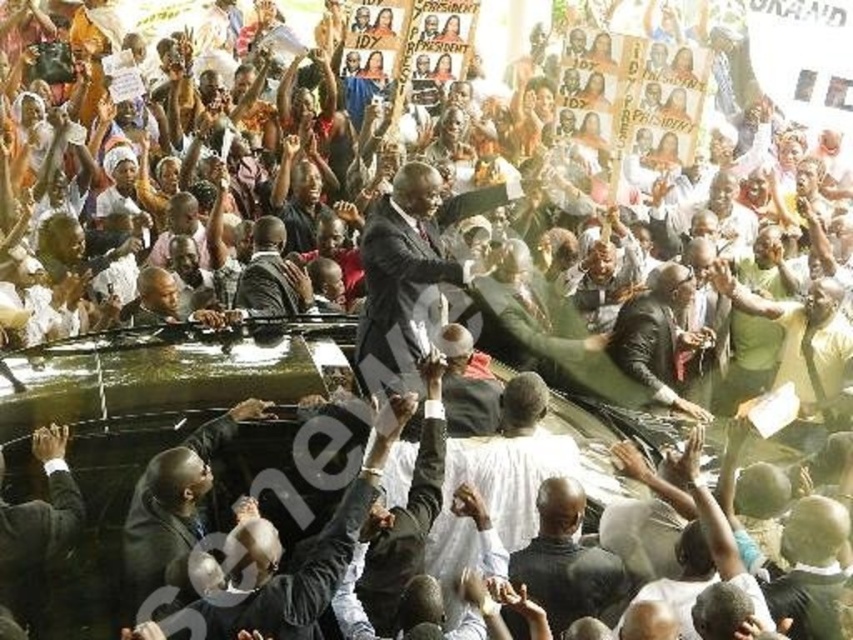
Question: Among these objects, which one is nearest to the camera?

Choices:
 (A) green matte shirt at right
 (B) dark brown leather jacket at center
 (C) dark brown suit at center

Answer: (C)

Question: Among these objects, which one is nearest to the camera?

Choices:
 (A) dark gray suit at center
 (B) green matte shirt at right

Answer: (A)

Question: Which of the following is the farthest from the observer?

Choices:
 (A) black suit at center
 (B) dark brown suit at center
 (C) dark brown leather jacket at center
 (D) dark gray suit at center

Answer: (C)

Question: Does dark brown leather jacket at center appear on the right side of dark brown suit at center?

Choices:
 (A) no
 (B) yes

Answer: (B)

Question: Does dark brown leather jacket at center have a lesser width compared to green matte shirt at right?

Choices:
 (A) no
 (B) yes

Answer: (B)

Question: Is black suit at center closer to the viewer compared to green matte shirt at right?

Choices:
 (A) no
 (B) yes

Answer: (B)